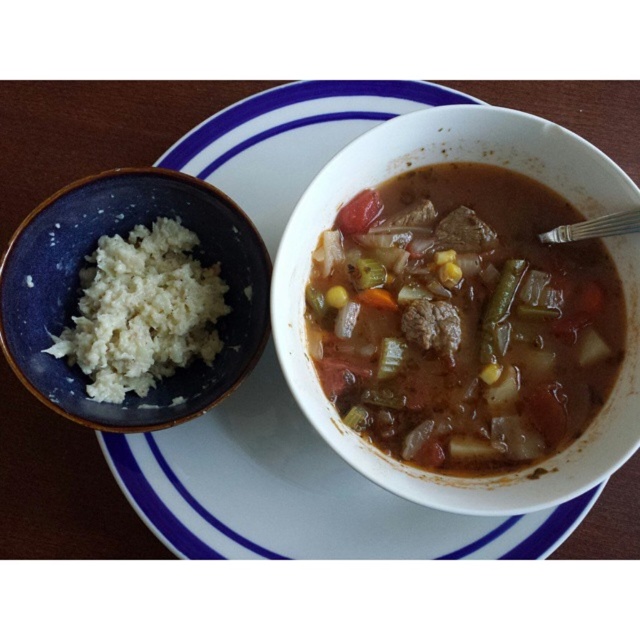
In the scene shown: Can you confirm if brown meat at center is wider than orange smooth carrot at center?

Yes, brown meat at center is wider than orange smooth carrot at center.

Can you confirm if brown meat at center is positioned to the left of orange smooth carrot at center?

Incorrect, brown meat at center is not on the left side of orange smooth carrot at center.

Does point (454, 353) lie behind point (364, 291)?

No, (454, 353) is closer to viewer.

I want to click on brown meat at center, so click(432, 324).

What do you see at coordinates (388, 356) in the screenshot? This screenshot has width=640, height=640. I see `green translucent celery at center` at bounding box center [388, 356].

I want to click on green translucent celery at center, so click(388, 356).

The height and width of the screenshot is (640, 640). I want to click on green translucent celery at center, so click(388, 356).

Is point (368, 208) less distant than point (355, 280)?

Yes.

Which of these two, green leafy vegetable at upper center or yellow-green textured celery at center, stands taller?

green leafy vegetable at upper center

Does point (374, 214) come behind point (353, 280)?

Yes, it is behind point (353, 280).

I want to click on green leafy vegetable at upper center, so click(x=358, y=212).